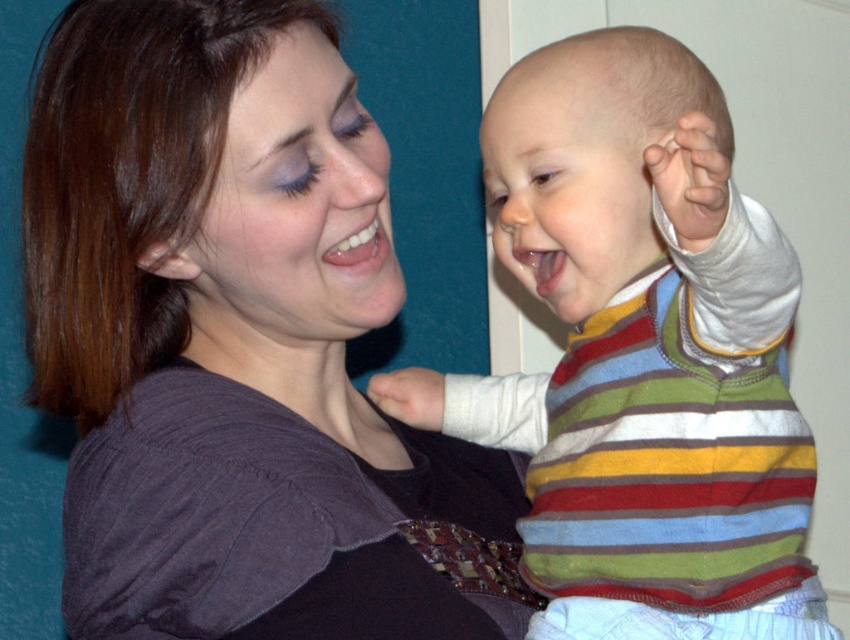
Can you confirm if striped sweater at upper right is thinner than striped sweater at center?

No, striped sweater at upper right is not thinner than striped sweater at center.

Which is more to the left, striped sweater at upper right or striped sweater at center?

From the viewer's perspective, striped sweater at upper right appears more on the left side.

Locate an element on the screen. This screenshot has width=850, height=640. striped sweater at upper right is located at coordinates (211, 268).